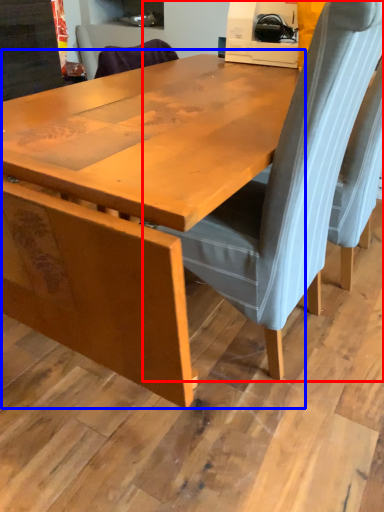
Question: Which of the following is the closest to the observer, chair (highlighted by a red box) or table (highlighted by a blue box)?

Choices:
 (A) chair
 (B) table

Answer: (B)